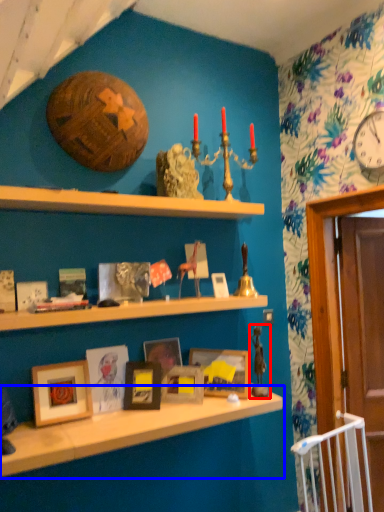
Question: Which object appears farthest to the camera in this image, toy (highlighted by a red box) or shelf (highlighted by a blue box)?

Choices:
 (A) toy
 (B) shelf

Answer: (A)